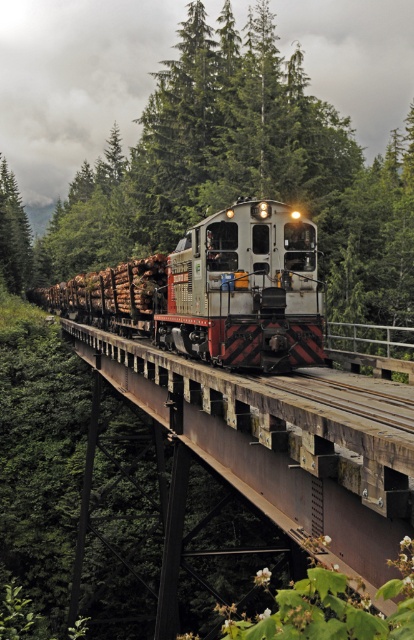
You are a passenger on the train and looking out the window. You see the green textured tree at center and the rustic wood bridge at center. Which one is closer to you?

The green textured tree at center is closer to you because the rustic wood bridge at center is behind it.

You are a maintenance worker on a train route. You need to inspect the distance between the rustic wood bridge at center and the brown wooden train track at center. According to safety regulations, the minimum safe distance must be at least 1.5 meters. Is the current distance compliant with the safety standard?

The distance between the rustic wood bridge at center and the brown wooden train track at center is 1.63 meters, which exceeds the minimum required 1.5 meters, so it complies with the safety standard.